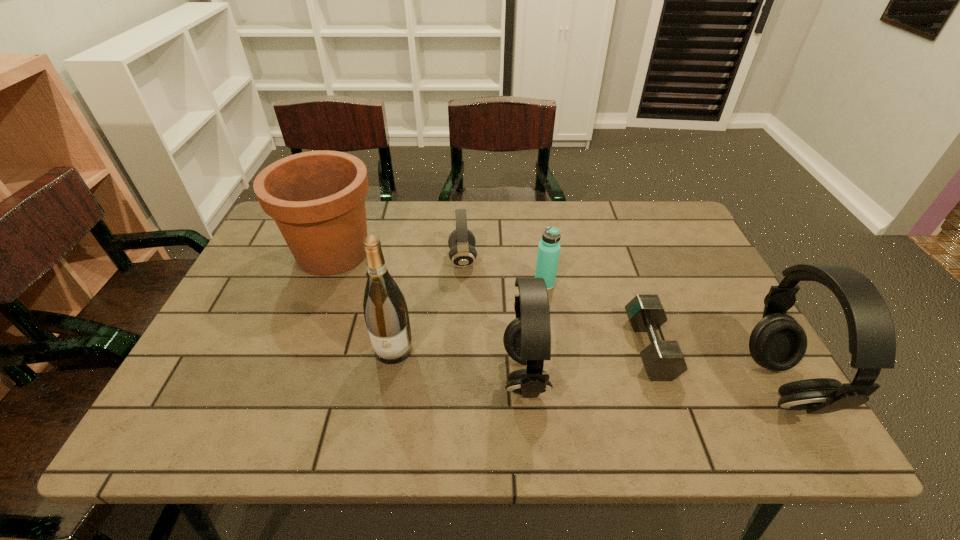
Where is `blank area located 0.140m on the left of the dumbbell`? blank area located 0.140m on the left of the dumbbell is located at coordinates click(570, 348).

Identify the location of flowerpot at the far edge. (317, 198).

Where is `headset at the far edge`? This screenshot has width=960, height=540. headset at the far edge is located at coordinates (461, 241).

This screenshot has width=960, height=540. Find the location of `dumbbell positioned at the near edge`. dumbbell positioned at the near edge is located at coordinates (663, 360).

I want to click on object at the left edge, so click(317, 198).

The height and width of the screenshot is (540, 960). What are the coordinates of `object that is at the right edge` in the screenshot? It's located at (777, 342).

Locate an element on the screen. object that is at the far left corner is located at coordinates (317, 198).

Locate an element on the screen. The image size is (960, 540). object located in the near right corner section of the desktop is located at coordinates (777, 342).

At what (x,y) coordinates should I click in order to perform the action: click on vacant space at the far edge of the desktop. Please return your answer as a coordinate pair (x, y). Looking at the image, I should click on tap(617, 220).

Identify the location of vacant space at the right edge. (663, 253).